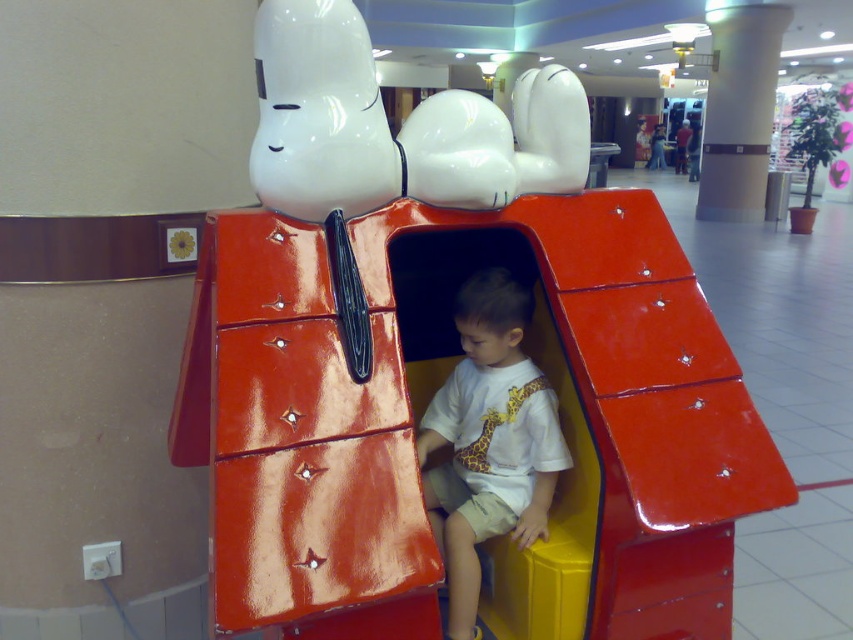
Identify the location of white glossy snoopy at upper center. (399, 128).

Is white glossy snoopy at upper center smaller than white glossy pillar at center?

Indeed, white glossy snoopy at upper center has a smaller size compared to white glossy pillar at center.

Locate an element on the screen. The width and height of the screenshot is (853, 640). white glossy snoopy at upper center is located at coordinates [399, 128].

Between white glossy snoopy at upper center and white matte shirt at center, which one appears on the left side from the viewer's perspective?

white glossy snoopy at upper center

Does white glossy snoopy at upper center have a smaller size compared to white matte shirt at center?

Incorrect, white glossy snoopy at upper center is not smaller in size than white matte shirt at center.

Which is behind, point (352, 10) or point (466, 554)?

The point (466, 554) is behind.

The width and height of the screenshot is (853, 640). I want to click on white glossy snoopy at upper center, so click(399, 128).

Which is above, white matte shirt at center or white glossy pillar at center?

Positioned higher is white glossy pillar at center.

Is white matte shirt at center positioned in front of white glossy pillar at center?

That is True.

This screenshot has width=853, height=640. Describe the element at coordinates (489, 440) in the screenshot. I see `white matte shirt at center` at that location.

I want to click on white matte shirt at center, so click(489, 440).